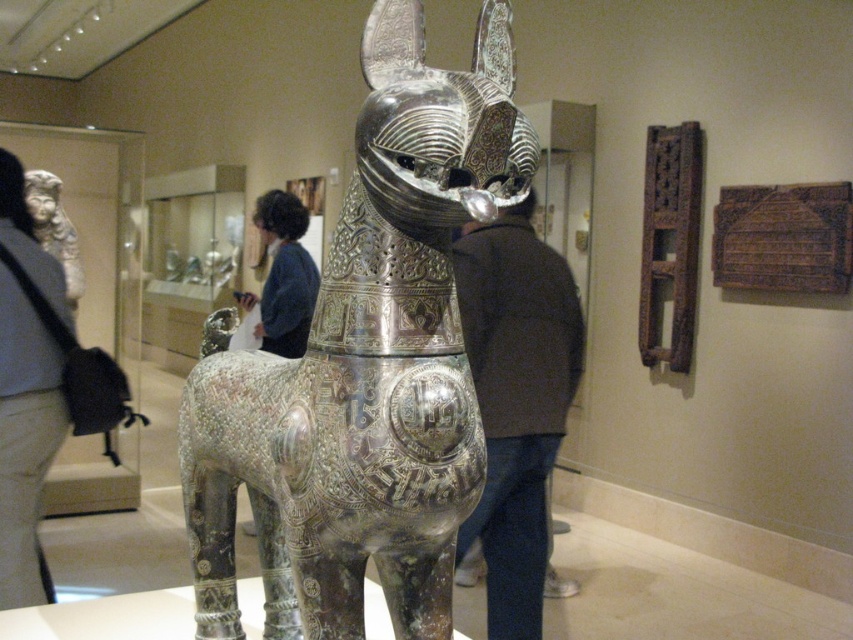
You are standing in the museum and want to take a photo of the metallic sculpture of a horse without any people in the frame. The dark brown leather jacket at center is blocking your view. What should you do?

Move to the left or right of the dark brown leather jacket at center to avoid blocking the view of the metallic sculpture of a horse.

You are a museum visitor who wants to take a photo of the polished silver horse at center and the dark blue sweater at center without any obstruction. Since you are standing in the center, which object should you move closer to ensure both are fully visible in your shot?

The polished silver horse at center is wider than the dark blue sweater at center. To capture both objects fully in your photo, you should move closer to the narrower dark blue sweater at center so that the wider polished silver horse at center can fit into the frame without being cut off.

You are standing in the museum and want to take a photo of the metallic sculpture of a horse. You notice two points on the sculpture labeled as point (35, 406) and point (302, 317). Which point will appear larger in your photo?

Point (35, 406) will appear larger in the photo because it is closer to the camera than point (302, 317).